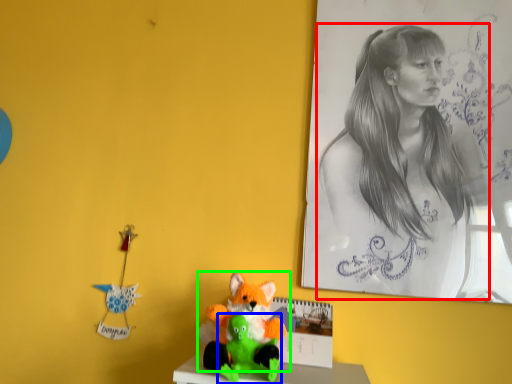
Question: Which is nearer to the woman (highlighted by a red box)? toy (highlighted by a blue box) or toy (highlighted by a green box).

Choices:
 (A) toy
 (B) toy

Answer: (B)